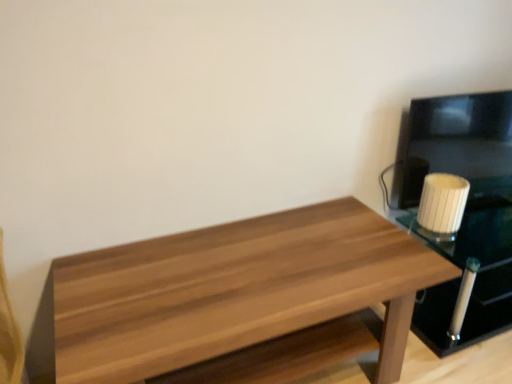
Question: Based on their sizes in the image, would you say white ribbed glass at right is bigger or smaller than wooden table at center?

Choices:
 (A) small
 (B) big

Answer: (A)

Question: Is white ribbed glass at right wider or thinner than wooden table at center?

Choices:
 (A) wide
 (B) thin

Answer: (B)

Question: Based on their relative distances, which object is farther from the wooden table at center?

Choices:
 (A) white glossy candle at right
 (B) white ribbed glass at right

Answer: (A)

Question: Which is nearer to the wooden table at center?

Choices:
 (A) white glossy candle at right
 (B) white ribbed glass at right

Answer: (B)